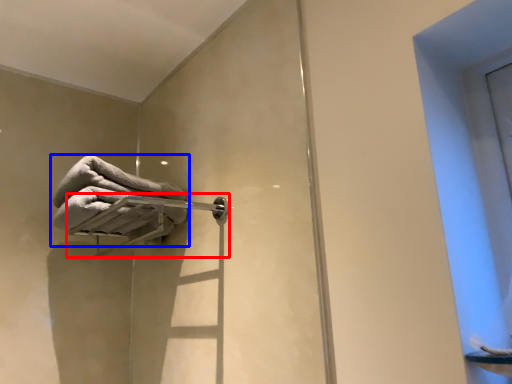
Question: Which point is further to the camera, towel bar (highlighted by a red box) or towel (highlighted by a blue box)?

Choices:
 (A) towel bar
 (B) towel

Answer: (B)